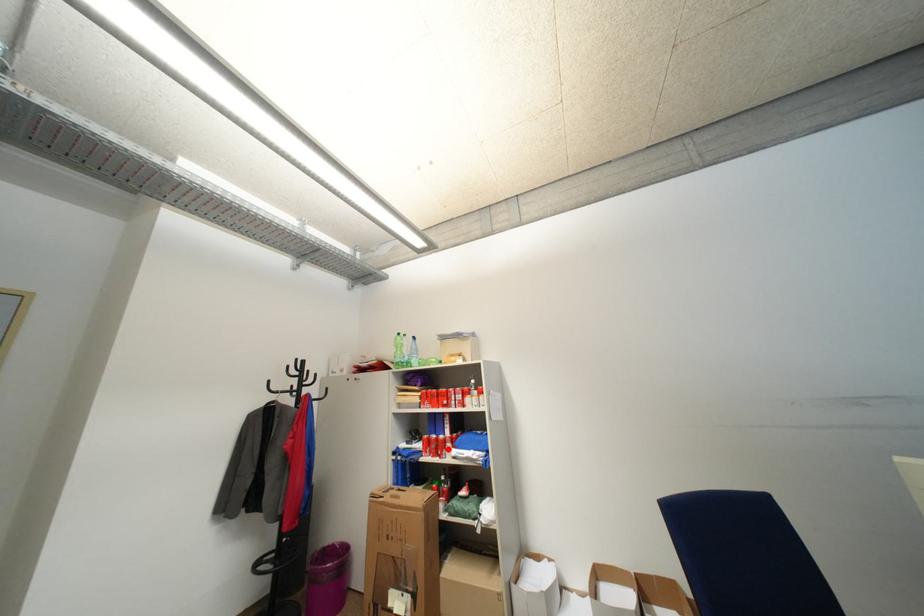
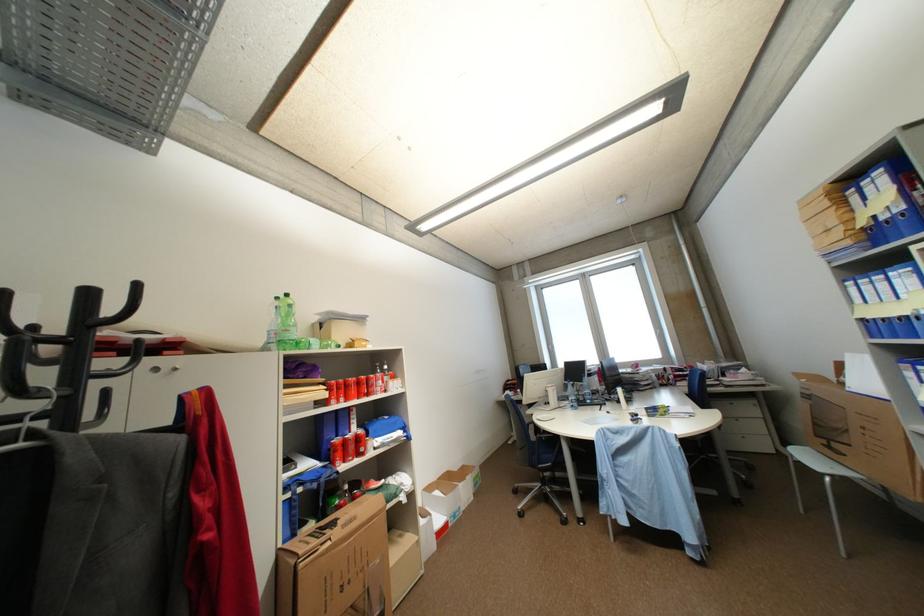
In the second image, find the point that corresponds to the highlighted location in the first image.

(368, 447)